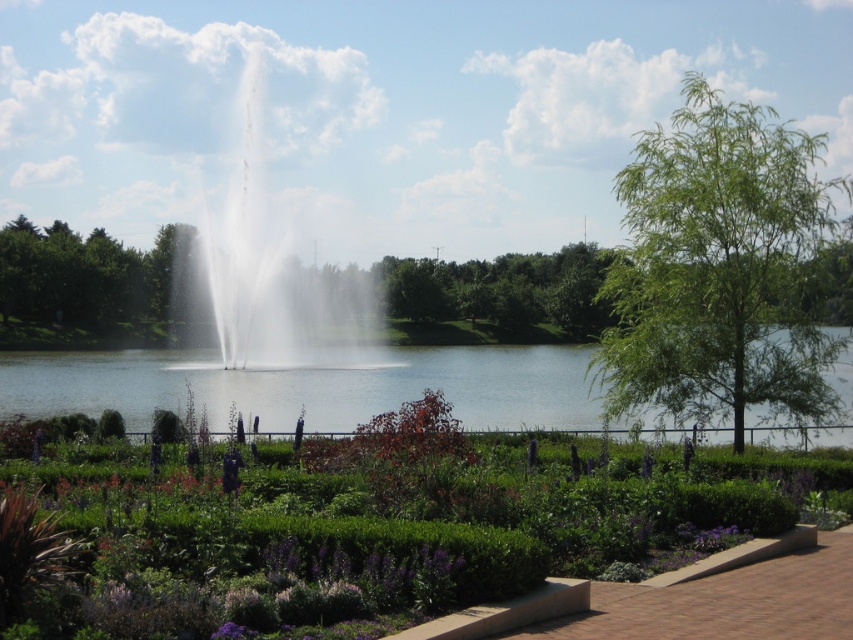
Which is behind, point (786, 307) or point (380, 396)?

The point (380, 396) is behind.

Identify the location of green leafy tree at right. The width and height of the screenshot is (853, 640). (718, 268).

Between green leafy shrubs at lower center and white water at center, which one has more height?

white water at center is taller.

Between green leafy shrubs at lower center and white water at center, which one is positioned higher?

Positioned higher is white water at center.

Is point (99, 609) farther from viewer compared to point (245, 346)?

No, it is in front of (245, 346).

The width and height of the screenshot is (853, 640). I want to click on green leafy shrubs at lower center, so click(x=341, y=540).

Can you confirm if white water at center is positioned below green leafy tree at left?

No, white water at center is not below green leafy tree at left.

Which is behind, point (212, 218) or point (183, 321)?

The point (212, 218) is more distant.

Where is `white water at center`? The width and height of the screenshot is (853, 640). white water at center is located at coordinates (260, 266).